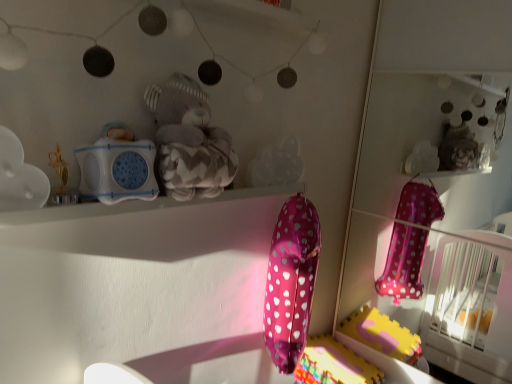
Question: From a real-world perspective, is translucent plastic cloud at center, which appears as the first toy when viewed from the right, positioned above or below white matte cloud at upper left, which is counted as the 4th toy, starting from the right?

Choices:
 (A) below
 (B) above

Answer: (A)

Question: In the image, is translucent plastic cloud at center, which appears as the first toy when viewed from the right, positioned in front of or behind white matte cloud at upper left, the 1th toy from the left?

Choices:
 (A) front
 (B) behind

Answer: (B)

Question: Based on their relative distances, which object is farther from the translucent plastic cloud at center, which appears as the first toy when viewed from the right?

Choices:
 (A) white matte cloud at upper left, the 1th toy from the left
 (B) pink polka dot balloon at lower center
 (C) pink metallic balloon at center
 (D) gray plush teddy bear at upper center, the second toy when ordered from right to left
 (E) white plastic speaker at upper center, which is counted as the 2th toy, starting from the left

Answer: (B)

Question: Estimate the real-world distances between objects in this image. Which object is closer to the white plastic speaker at upper center, which is counted as the 2th toy, starting from the left?

Choices:
 (A) pink polka dot balloon at lower center
 (B) white matte cloud at upper left, the 1th toy from the left
 (C) translucent plastic cloud at center, which appears as the first toy when viewed from the right
 (D) pink metallic balloon at center
 (E) gray plush teddy bear at upper center, acting as the third toy starting from the left

Answer: (E)